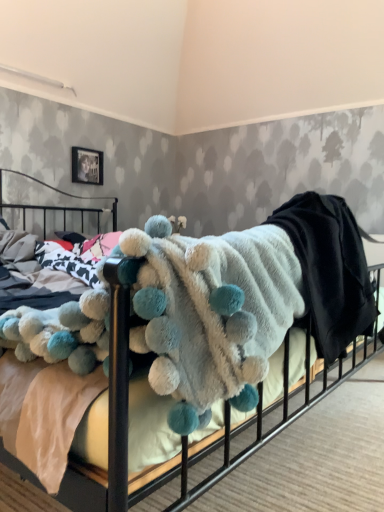
Question: From their relative heights in the image, would you say metallic silver picture frame at upper left is taller or shorter than fluffy white blanket with blue pom-poms at center?

Choices:
 (A) tall
 (B) short

Answer: (B)

Question: Considering their positions, is metallic silver picture frame at upper left located in front of or behind fluffy white blanket with blue pom-poms at center?

Choices:
 (A) front
 (B) behind

Answer: (B)

Question: Which is nearer to the fluffy white blanket with blue pom-poms at center?

Choices:
 (A) fluffy white blanket at center
 (B) metallic silver picture frame at upper left

Answer: (A)

Question: Which object is positioned farthest from the metallic silver picture frame at upper left?

Choices:
 (A) fluffy white blanket at center
 (B) fluffy white blanket with blue pom-poms at center

Answer: (B)